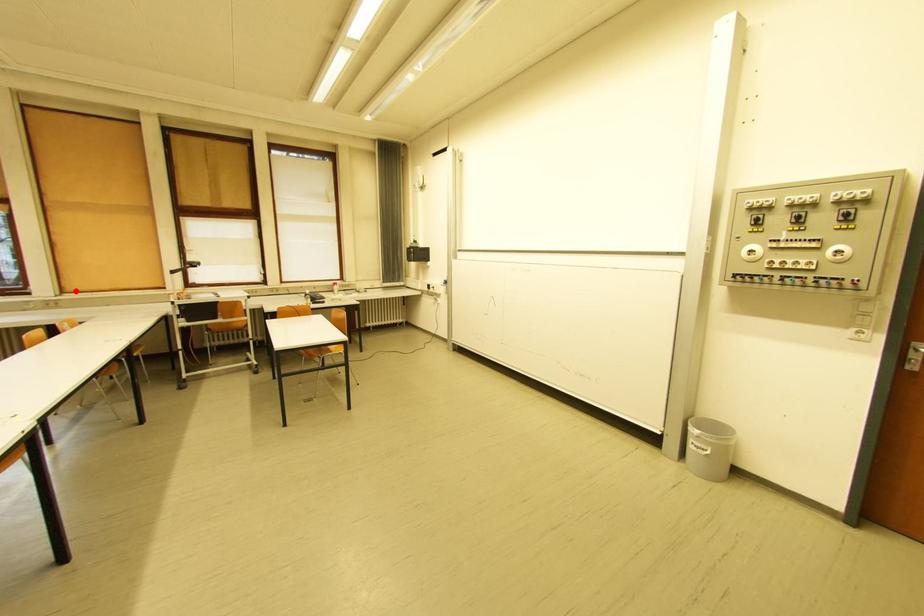
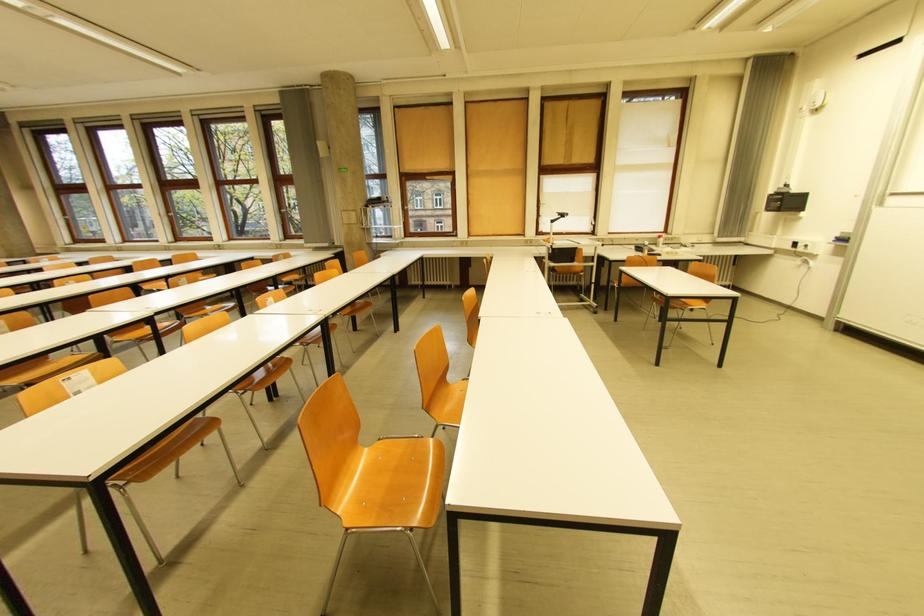
Locate, in the second image, the point that corresponds to the highlighted location in the first image.

(479, 235)